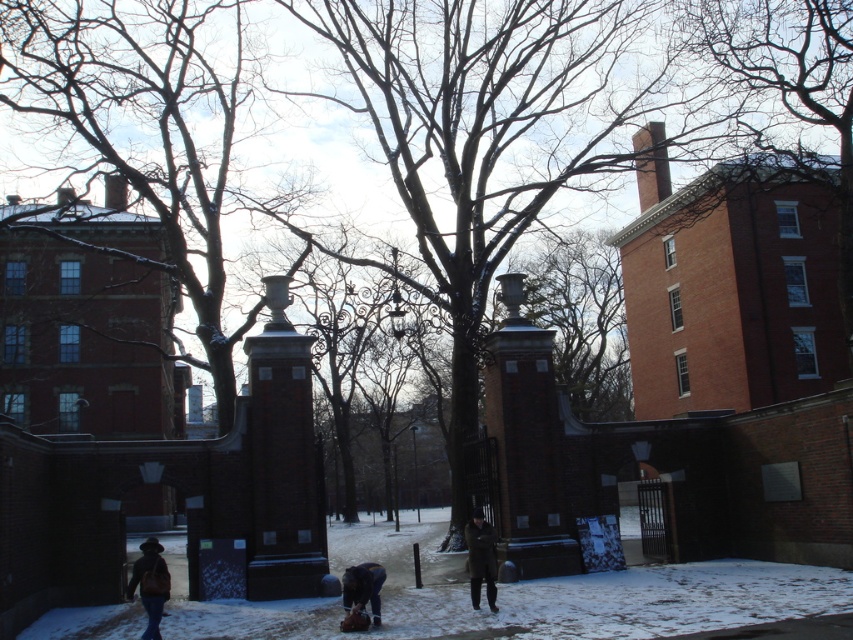
Who is taller, dark brown leather jacket at lower left or dark brown leather jacket at lower center?

Standing taller between the two is dark brown leather jacket at lower left.

Is dark brown leather jacket at lower left positioned at the back of dark brown leather jacket at lower center?

Yes, it is.

Measure the distance between dark brown leather jacket at lower left and camera.

dark brown leather jacket at lower left is 34.20 meters away from camera.

Identify the location of dark brown leather jacket at lower left. (149, 584).

Which is more to the right, bare branches at upper right or dark brown leather coat at center?

bare branches at upper right

Does point (788, 68) come behind point (473, 522)?

Yes, it is.

This screenshot has width=853, height=640. What do you see at coordinates (796, 80) in the screenshot?
I see `bare branches at upper right` at bounding box center [796, 80].

Where is `bare branches at upper right`? The image size is (853, 640). bare branches at upper right is located at coordinates (796, 80).

This screenshot has width=853, height=640. Find the location of `bare branches at upper right`. bare branches at upper right is located at coordinates (796, 80).

In the scene shown: Between bare branches at upper right and dark brown leather jacket at lower left, which one has less height?

Standing shorter between the two is dark brown leather jacket at lower left.

Does point (799, 74) lie behind point (154, 560)?

Yes, point (799, 74) is farther from viewer.

You are a GUI agent. You are given a task and a screenshot of the screen. Output one action in this format:
    pyautogui.click(x=<x>, y=<y>)
    Task: Click on the bare branches at upper right
    
    Given the screenshot: What is the action you would take?
    pyautogui.click(x=796, y=80)